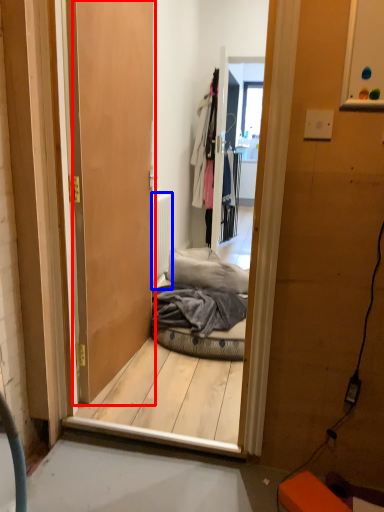
Question: Which object appears closest to the camera in this image, door (highlighted by a red box) or radiator (highlighted by a blue box)?

Choices:
 (A) door
 (B) radiator

Answer: (A)